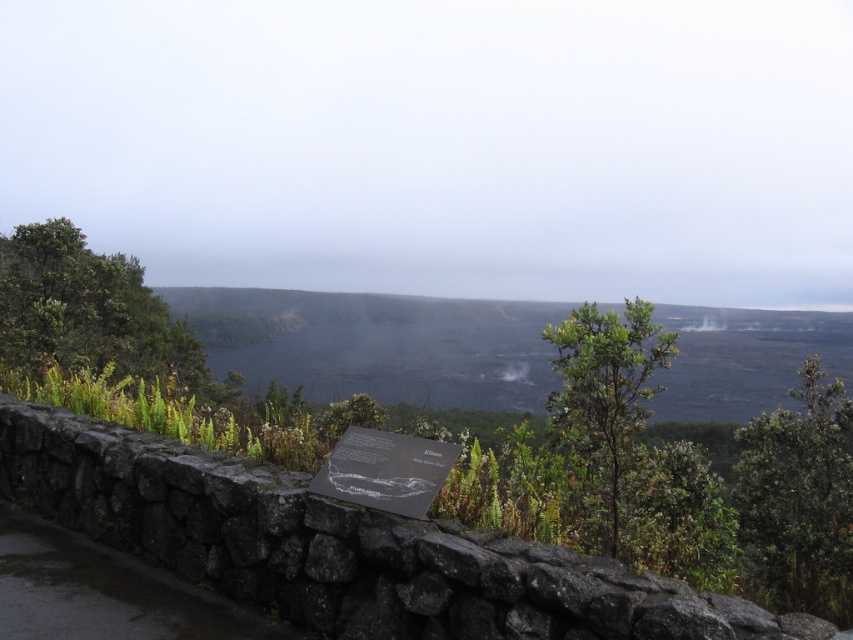
Question: Among these points, which one is farthest from the camera?

Choices:
 (A) (584, 435)
 (B) (564, 368)

Answer: (B)

Question: Does green leafy shrubs at lower center have a smaller size compared to green leafy shrub at center?

Choices:
 (A) no
 (B) yes

Answer: (A)

Question: Is green leafy shrubs at lower center behind green leafy shrub at center?

Choices:
 (A) yes
 (B) no

Answer: (A)

Question: In this image, where is green leafy shrubs at lower center located relative to green leafy shrub at center?

Choices:
 (A) right
 (B) left

Answer: (B)